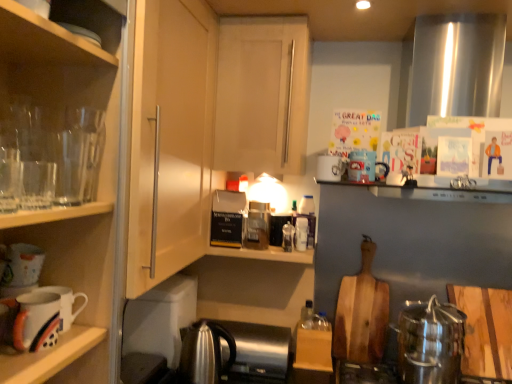
Question: Is satin silver kettle at lower center turned away from satin silver kettle at lower center?

Choices:
 (A) yes
 (B) no

Answer: (A)

Question: Can you confirm if satin silver kettle at lower center is thinner than satin silver kettle at lower center?

Choices:
 (A) no
 (B) yes

Answer: (B)

Question: Considering the relative sizes of satin silver kettle at lower center and satin silver kettle at lower center in the image provided, is satin silver kettle at lower center taller than satin silver kettle at lower center?

Choices:
 (A) yes
 (B) no

Answer: (A)

Question: Is satin silver kettle at lower center wider than satin silver kettle at lower center?

Choices:
 (A) yes
 (B) no

Answer: (B)

Question: From a real-world perspective, does satin silver kettle at lower center stand above satin silver kettle at lower center?

Choices:
 (A) no
 (B) yes

Answer: (B)

Question: Is there a large distance between satin silver kettle at lower center and satin silver kettle at lower center?

Choices:
 (A) yes
 (B) no

Answer: (B)

Question: Does white matte cabinet door at center, the second cabinetry in the front-to-back sequence, have a lesser height compared to transparent glassware at left?

Choices:
 (A) no
 (B) yes

Answer: (A)

Question: Can you confirm if white matte cabinet door at center, the second cabinetry in the front-to-back sequence, is positioned to the left of transparent glassware at left?

Choices:
 (A) yes
 (B) no

Answer: (B)

Question: From the image's perspective, is white matte cabinet door at center, the second cabinetry in the front-to-back sequence, above transparent glassware at left?

Choices:
 (A) no
 (B) yes

Answer: (B)

Question: Is white matte cabinet door at center, acting as the 1th cabinetry starting from the right, oriented away from transparent glassware at left?

Choices:
 (A) no
 (B) yes

Answer: (A)

Question: From a real-world perspective, is white matte cabinet door at center, which is counted as the 2th cabinetry, starting from the left, located higher than transparent glassware at left?

Choices:
 (A) yes
 (B) no

Answer: (A)

Question: Can you confirm if white matte cabinet door at center, the second cabinetry in the front-to-back sequence, is smaller than transparent glassware at left?

Choices:
 (A) yes
 (B) no

Answer: (B)

Question: Is transparent glassware at left at the right side of white glossy mug at upper center, which ranks as the 3th mug in bottom-to-top order?

Choices:
 (A) yes
 (B) no

Answer: (B)